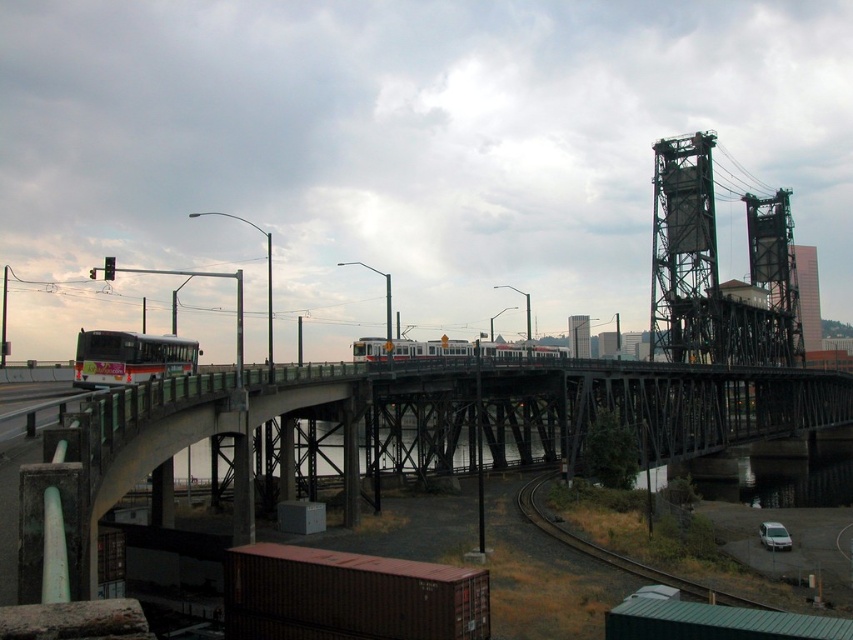
You are a pedestrian standing on the sidewalk and want to cross the road to reach the concrete bridge at center. There is a white matte bus at left blocking your path. Can you safely walk around the bus to get to the bridge?

The concrete bridge at center is closer to the viewer than the white matte bus at left, so the bus is further away. You can safely walk around the bus to reach the bridge.

You are standing at the origin point of the image. Which direction should you move to reach the white matte bus at left?

You should move to the left to reach the white matte bus at left since it is located at point (131,356) which is on the left side of the image.

You are a delivery person trying to navigate through the scene. You need to pass under the white matte bus at left and over the dark gray metal train track at lower right. Can you confirm if there is enough vertical clearance to pass under the bus and over the train track without hitting either?

The white matte bus at left is taller than the dark gray metal train track at lower right, so there is sufficient vertical clearance to pass under the bus and over the train track without any collision.